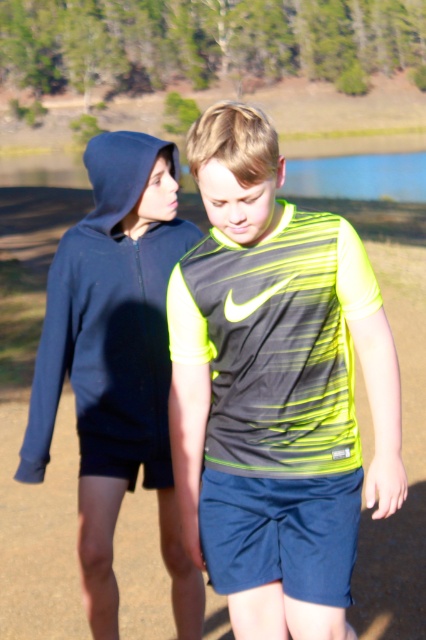
Which is below, navy blue hoodie at left or navy blue shorts at center?

Positioned lower is navy blue shorts at center.

Can you confirm if navy blue hoodie at left is bigger than navy blue shorts at center?

Yes.

Is point (103, 353) more distant than point (267, 520)?

Yes.

This screenshot has width=426, height=640. Find the location of `navy blue hoodie at left`. navy blue hoodie at left is located at coordinates (109, 324).

Between neon yellow fabric shirt at center and navy blue hoodie at left, which one has less height?

navy blue hoodie at left is shorter.

Between point (348, 556) and point (92, 166), which one is positioned in front?

Point (348, 556) is in front.

You are a GUI agent. You are given a task and a screenshot of the screen. Output one action in this format:
    pyautogui.click(x=<x>, y=<y>)
    Task: Click on the neon yellow fabric shirt at center
    The image size is (426, 640).
    Given the screenshot: What is the action you would take?
    [x=273, y=381]

Based on the photo, does dirt track at center have a larger size compared to navy blue hoodie at left?

Incorrect, dirt track at center is not larger than navy blue hoodie at left.

Is point (414, 387) farther from camera compared to point (94, 406)?

Yes, it is.

In order to click on dirt track at center in this screenshot , I will do `click(405, 465)`.

In order to click on dirt track at center in this screenshot , I will do [x=405, y=465].